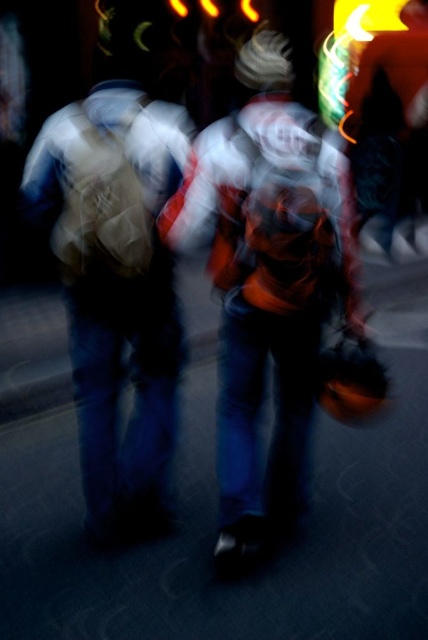
Question: Is orange fabric jacket at center to the right of matte brown backpack at left from the viewer's perspective?

Choices:
 (A) no
 (B) yes

Answer: (B)

Question: Which point is farther to the camera?

Choices:
 (A) (234, 541)
 (B) (92, 436)

Answer: (B)

Question: Does orange fabric jacket at center have a larger size compared to matte brown backpack at left?

Choices:
 (A) yes
 (B) no

Answer: (A)

Question: Does orange fabric jacket at center appear on the right side of matte brown backpack at left?

Choices:
 (A) no
 (B) yes

Answer: (B)

Question: Which object appears farthest from the camera in this image?

Choices:
 (A) orange fabric jacket at center
 (B) matte brown backpack at left

Answer: (B)